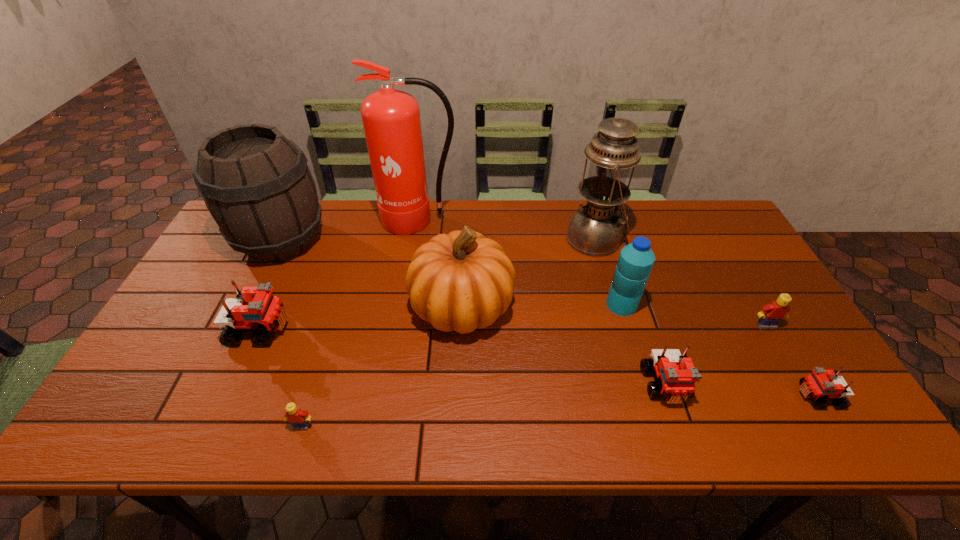
Locate an element on the screen. This screenshot has height=540, width=960. vacant space located on the front-facing side of the tallest Lego is located at coordinates (405, 329).

Where is `vacant space situated on the front-facing side of the right yellow Lego`? The image size is (960, 540). vacant space situated on the front-facing side of the right yellow Lego is located at coordinates (783, 355).

I want to click on free space located on the front-facing side of the third Lego from left to right, so click(680, 429).

The width and height of the screenshot is (960, 540). Find the location of `free space located on the front-facing side of the smallest red Lego`. free space located on the front-facing side of the smallest red Lego is located at coordinates (x=743, y=396).

Identify the location of vacant area situated on the front-facing side of the smallest red Lego. (708, 396).

Locate an element on the screen. The image size is (960, 540). free space located 0.400m on the front-facing side of the smallest red Lego is located at coordinates (627, 396).

Identify the location of fire extinguisher that is at the far edge. (391, 120).

Find the location of a particular element. This screenshot has width=960, height=540. oil lamp situated at the far edge is located at coordinates (595, 229).

Where is `wine bucket present at the far edge`? wine bucket present at the far edge is located at coordinates (256, 184).

The width and height of the screenshot is (960, 540). Find the location of `object located at the left edge`. object located at the left edge is located at coordinates (256, 184).